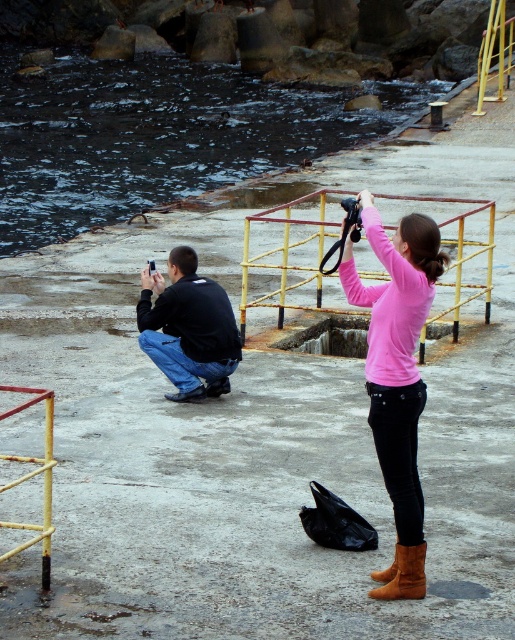
Question: Is the position of yellow metal railing at center more distant than that of brown suede boot at lower center?

Choices:
 (A) yes
 (B) no

Answer: (A)

Question: Is pink matte sweater at center above yellow metal railing at center?

Choices:
 (A) no
 (B) yes

Answer: (A)

Question: Which point is farther from the camera taking this photo?

Choices:
 (A) (199, 385)
 (B) (403, 561)
 (C) (303, 202)
 (D) (394, 353)

Answer: (C)

Question: Among these objects, which one is nearest to the camera?

Choices:
 (A) yellow metal railing at center
 (B) brown suede boot at lower center
 (C) pink matte sweater at center

Answer: (C)

Question: Which point is farther to the camera?

Choices:
 (A) yellow metal railing at center
 (B) black matte jacket at lower left
 (C) pink matte sweater at center
 (D) brown suede boot at lower center

Answer: (B)

Question: Can you confirm if pink matte sweater at center is positioned below black matte jacket at lower left?

Choices:
 (A) no
 (B) yes

Answer: (B)